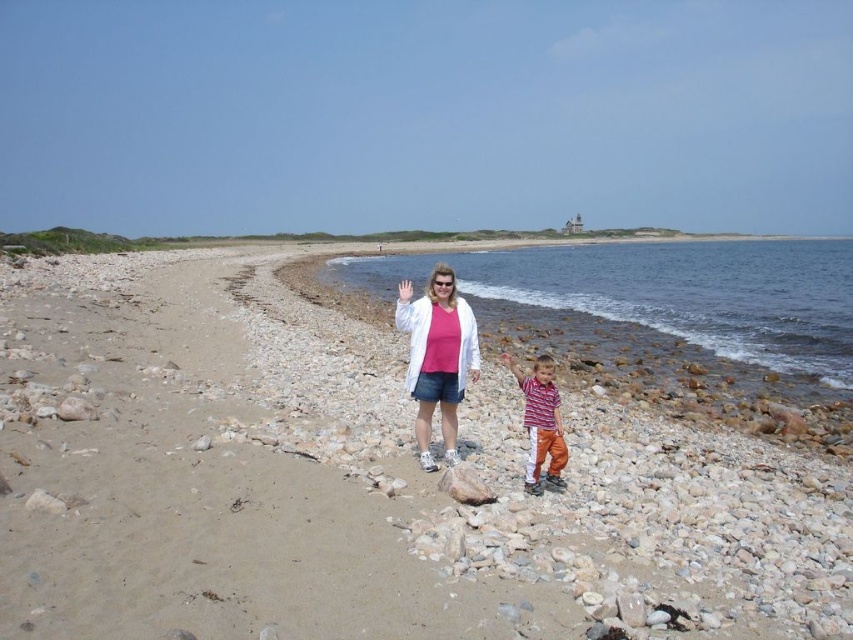
Is matte white jacket at center to the right of striped cotton shirt at center from the viewer's perspective?

In fact, matte white jacket at center is to the left of striped cotton shirt at center.

Can you confirm if matte white jacket at center is taller than striped cotton shirt at center?

Yes, matte white jacket at center is taller than striped cotton shirt at center.

This screenshot has height=640, width=853. I want to click on matte white jacket at center, so click(x=437, y=356).

Identify the location of smooth pebbles at center. This screenshot has height=640, width=853. (354, 481).

Can you confirm if smooth pebbles at center is taller than striped cotton shirt at center?

Yes.

Is point (138, 586) behind point (547, 362)?

No, (138, 586) is in front of (547, 362).

You are a GUI agent. You are given a task and a screenshot of the screen. Output one action in this format:
    pyautogui.click(x=<x>, y=<y>)
    Task: Click on the smooth pebbles at center
    
    Given the screenshot: What is the action you would take?
    pyautogui.click(x=354, y=481)

Does smooth pebbles at center have a greater width compared to matte white jacket at center?

Indeed, smooth pebbles at center has a greater width compared to matte white jacket at center.

Is smooth pebbles at center closer to camera compared to matte white jacket at center?

Yes.

This screenshot has height=640, width=853. What do you see at coordinates (354, 481) in the screenshot?
I see `smooth pebbles at center` at bounding box center [354, 481].

Where is `smooth pebbles at center`? This screenshot has width=853, height=640. smooth pebbles at center is located at coordinates (354, 481).